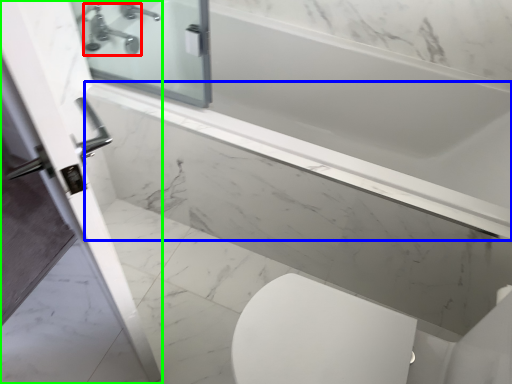
Question: Considering the real-world distances, which object is farthest from tap (highlighted by a red box)? ledge (highlighted by a blue box) or screen door (highlighted by a green box)?

Choices:
 (A) ledge
 (B) screen door

Answer: (B)